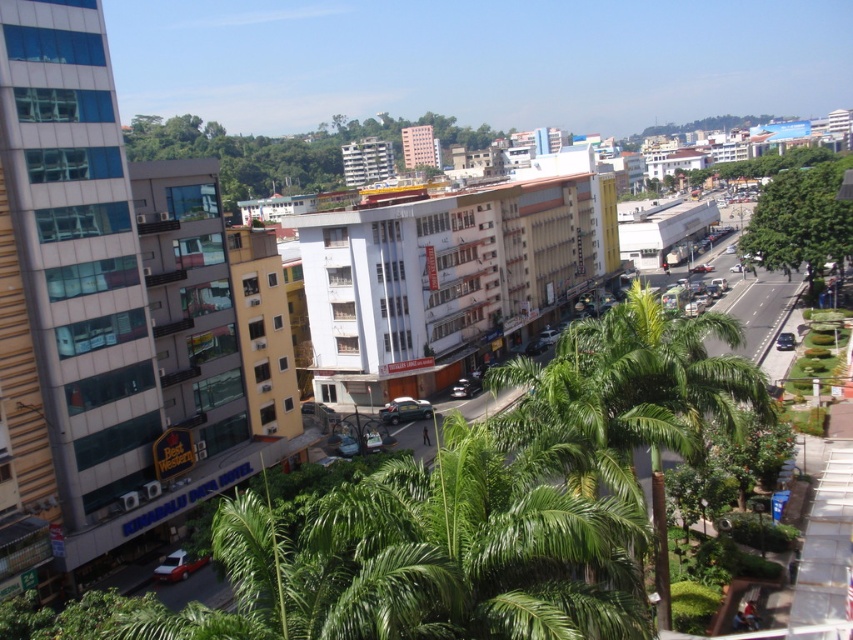
You are standing on a balcony overlooking the street. You see a green leafy tree at center and a metallic green car at center. Which object is positioned to the left when viewed from your perspective?

The green leafy tree at center is to the left of the metallic green car at center from your perspective.

You are standing on a balcony overlooking the city. You want to take a photo of the green leafy tree at center. Where should you aim your camera to capture it in the frame?

The green leafy tree at center is located at the 2D coordinates point (258,152), so you should aim your camera towards that point to capture it in the frame.